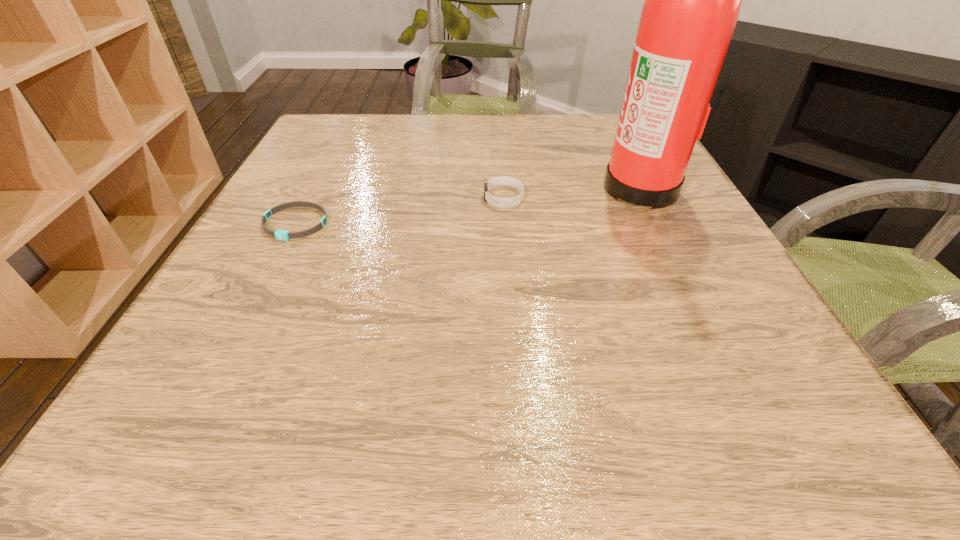
Locate an element on the screen. The image size is (960, 540). fire extinguisher is located at coordinates (692, 2).

At what (x,y) coordinates should I click in order to perform the action: click on the rightmost object. Please return your answer as a coordinate pair (x, y). Image resolution: width=960 pixels, height=540 pixels. Looking at the image, I should click on (692, 2).

Locate an element on the screen. Image resolution: width=960 pixels, height=540 pixels. the second object from right to left is located at coordinates (501, 180).

Where is `the right wristband`? Image resolution: width=960 pixels, height=540 pixels. the right wristband is located at coordinates click(501, 180).

Identify the location of the shortest object. This screenshot has width=960, height=540. (284, 235).

At what (x,y) coordinates should I click in order to perform the action: click on the shorter wristband. Please return your answer as a coordinate pair (x, y). Image resolution: width=960 pixels, height=540 pixels. Looking at the image, I should click on (284, 235).

Find the location of a particular element. vacant space located 0.090m on the label side of the rightmost object is located at coordinates 561,186.

Image resolution: width=960 pixels, height=540 pixels. What are the coordinates of `vacant space located on the label side of the rightmost object` in the screenshot? It's located at (561, 186).

Find the location of a particular element. This screenshot has width=960, height=540. vacant space situated 0.310m on the label side of the rightmost object is located at coordinates (456, 186).

The width and height of the screenshot is (960, 540). Identify the location of vacant area situated 0.210m on the outer surface of the taller wristband. (380, 198).